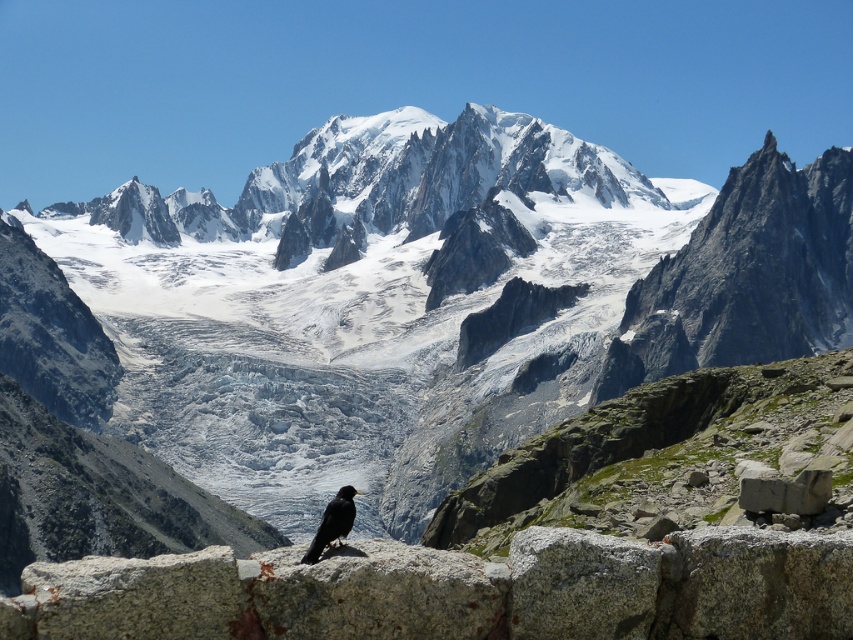
You are a hiker standing at the base of the mountain, looking at the gray stone at lower right and the black matte bird at lower center. Which object is closer to you?

The gray stone at lower right is closer to you because the black matte bird at lower center is behind it.

You are a hiker standing at the base of the mountain and see the gray stone at lower right and the black matte bird at lower center. Which object is located to the right of the other?

The gray stone at lower right is positioned on the right side of the black matte bird at lower center, so the gray stone at lower right is to the right of the black matte bird at lower center.